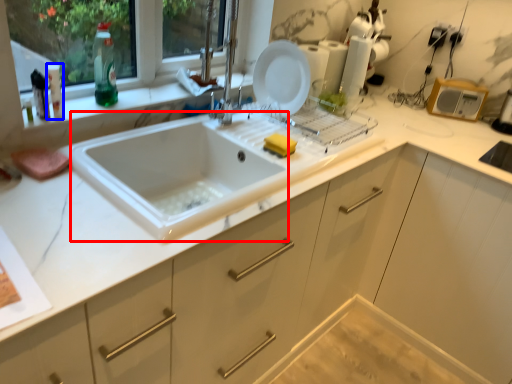
Question: Which of the following is the farthest to the observer, sink (highlighted by a red box) or bottle (highlighted by a blue box)?

Choices:
 (A) sink
 (B) bottle

Answer: (B)